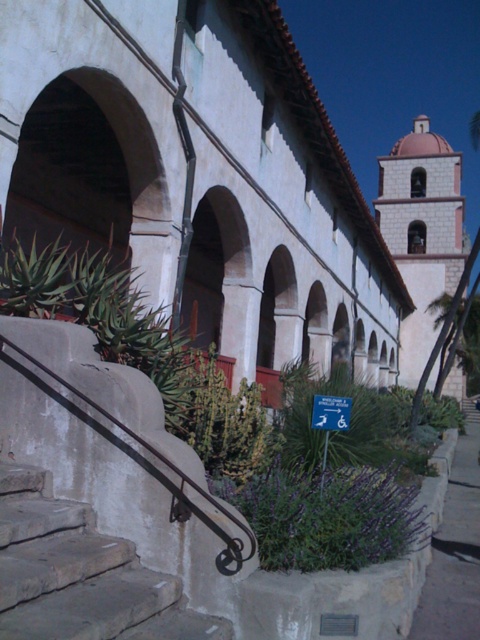
Between purple leafy plant at lower center and rusty metal handrail at lower left, which one has more height?

With more height is rusty metal handrail at lower left.

Between purple leafy plant at lower center and rusty metal handrail at lower left, which one has less height?

With less height is purple leafy plant at lower center.

Who is more forward, (x=339, y=552) or (x=151, y=388)?

Positioned in front is point (x=339, y=552).

Where is `purple leafy plant at lower center`? The height and width of the screenshot is (640, 480). purple leafy plant at lower center is located at coordinates (325, 515).

Is rusty metal handrail at lower left in front of gray concrete pavement at lower right?

That is True.

Looking at this image, between rusty metal handrail at lower left and gray concrete pavement at lower right, which one is positioned higher?

rusty metal handrail at lower left is above.

Between point (88, 417) and point (474, 410), which one is positioned behind?

Positioned behind is point (474, 410).

Where is `rusty metal handrail at lower left`? The width and height of the screenshot is (480, 640). rusty metal handrail at lower left is located at coordinates [140, 458].

Can you confirm if concrete stairs at lower left is shorter than gray concrete pavement at lower right?

Yes.

Which is behind, point (160, 605) or point (479, 538)?

Point (479, 538)

The height and width of the screenshot is (640, 480). Identify the location of concrete stairs at lower left. (81, 573).

Identify the location of concrete stairs at lower left. (81, 573).